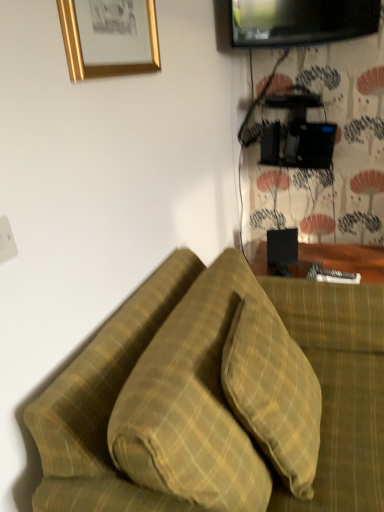
This screenshot has width=384, height=512. Describe the element at coordinates (109, 37) in the screenshot. I see `gold metallic picture frame at upper left` at that location.

Measure the distance between point (305, 3) and camera.

6.36 feet.

The width and height of the screenshot is (384, 512). Identify the location of green plaid pillow at center, positioned as the 2th pillow in right-to-left order. (220, 399).

This screenshot has height=512, width=384. What do you see at coordinates (220, 399) in the screenshot? I see `green plaid pillow at center, positioned as the 2th pillow in right-to-left order` at bounding box center [220, 399].

Locate an element on the screen. The width and height of the screenshot is (384, 512). gold metallic picture frame at upper left is located at coordinates (109, 37).

Is gold metallic picture frame at upper left closer to the viewer compared to yellow plaid pillow at center, the first pillow viewed from the right?

No, gold metallic picture frame at upper left is further to the viewer.

Does gold metallic picture frame at upper left have a larger size compared to yellow plaid pillow at center, the first pillow viewed from the right?

No, gold metallic picture frame at upper left is not bigger than yellow plaid pillow at center, the first pillow viewed from the right.

Is there a large distance between gold metallic picture frame at upper left and yellow plaid pillow at center, the first pillow viewed from the right?

Actually, gold metallic picture frame at upper left and yellow plaid pillow at center, the first pillow viewed from the right, are a little close together.

Can you tell me how much gold metallic picture frame at upper left and yellow plaid pillow at center, the second pillow when ordered from left to right, differ in facing direction?

5.81 degrees.

Is gold metallic picture frame at upper left situated inside black glossy tv at upper right or outside?

gold metallic picture frame at upper left is not enclosed by black glossy tv at upper right.

Considering the sizes of objects gold metallic picture frame at upper left and black glossy tv at upper right in the image provided, who is shorter, gold metallic picture frame at upper left or black glossy tv at upper right?

black glossy tv at upper right.

Is gold metallic picture frame at upper left aimed at black glossy tv at upper right?

No, gold metallic picture frame at upper left does not turn towards black glossy tv at upper right.

Locate an element on the screen. This screenshot has height=512, width=384. television above the gold metallic picture frame at upper left (from a real-world perspective) is located at coordinates (301, 21).

From a real-world perspective, which object rests below the other?

green plaid pillow at center, which ranks as the first pillow in left-to-right order, is physically lower.

Is gold metallic picture frame at upper left positioned beyond the bounds of green plaid pillow at center, which ranks as the first pillow in left-to-right order?

That's correct, gold metallic picture frame at upper left is outside of green plaid pillow at center, which ranks as the first pillow in left-to-right order.

From the image's perspective, is gold metallic picture frame at upper left located above or below green plaid pillow at center, which ranks as the first pillow in left-to-right order?

gold metallic picture frame at upper left is situated higher than green plaid pillow at center, which ranks as the first pillow in left-to-right order, in the image.

In the scene shown: From the image's perspective, who appears lower, black glossy tv at upper right or green plaid pillow at center, which ranks as the first pillow in left-to-right order?

From the image's view, green plaid pillow at center, which ranks as the first pillow in left-to-right order, is below.

Who is shorter, black glossy tv at upper right or green plaid pillow at center, positioned as the 2th pillow in right-to-left order?

With less height is black glossy tv at upper right.

From the image's perspective, count 2nd pillows downward from the black glossy tv at upper right and point to it. Please provide its 2D coordinates.

[(220, 399)]

Between point (238, 31) and point (194, 486), which one is positioned in front?

The point (194, 486) is more forward.

Does black glossy tv at upper right contain yellow plaid pillow at center, the second pillow when ordered from left to right?

No, yellow plaid pillow at center, the second pillow when ordered from left to right, is located outside of black glossy tv at upper right.

Who is more distant, black glossy tv at upper right or yellow plaid pillow at center, the second pillow when ordered from left to right?

black glossy tv at upper right is more distant.

From a real-world perspective, who is located lower, black glossy tv at upper right or yellow plaid pillow at center, the second pillow when ordered from left to right?

yellow plaid pillow at center, the second pillow when ordered from left to right.

Identify the location of television that appears above the yellow plaid pillow at center, the second pillow when ordered from left to right (from the image's perspective). This screenshot has height=512, width=384. (301, 21).

From the image's perspective, between yellow plaid pillow at center, the first pillow viewed from the right, and gold metallic picture frame at upper left, who is located below?

yellow plaid pillow at center, the first pillow viewed from the right, from the image's perspective.

Can you confirm if yellow plaid pillow at center, the second pillow when ordered from left to right, is taller than gold metallic picture frame at upper left?

Correct, yellow plaid pillow at center, the second pillow when ordered from left to right, is much taller as gold metallic picture frame at upper left.

Could you measure the distance between yellow plaid pillow at center, the first pillow viewed from the right, and gold metallic picture frame at upper left?

yellow plaid pillow at center, the first pillow viewed from the right, and gold metallic picture frame at upper left are 34.21 inches apart.

Is point (289, 410) closer or farther from the camera than point (133, 55)?

Point (289, 410) is positioned closer to the camera compared to point (133, 55).

What's the angular difference between green plaid pillow at center, positioned as the 2th pillow in right-to-left order, and gold metallic picture frame at upper left's facing directions?

1.66 degrees.

Does green plaid pillow at center, positioned as the 2th pillow in right-to-left order, appear on the right side of gold metallic picture frame at upper left?

Correct, you'll find green plaid pillow at center, positioned as the 2th pillow in right-to-left order, to the right of gold metallic picture frame at upper left.

Is green plaid pillow at center, positioned as the 2th pillow in right-to-left order, directly adjacent to gold metallic picture frame at upper left?

No, green plaid pillow at center, positioned as the 2th pillow in right-to-left order, is not making contact with gold metallic picture frame at upper left.

The height and width of the screenshot is (512, 384). There is a yellow plaid pillow at center, the second pillow when ordered from left to right. In order to click on picture frame above it (from a real-world perspective) in this screenshot , I will do `click(109, 37)`.

Locate an element on the screen. picture frame that appears on the left of black glossy tv at upper right is located at coordinates (109, 37).

When comparing their distances from green plaid pillow at center, which ranks as the first pillow in left-to-right order, does gold metallic picture frame at upper left or yellow plaid pillow at center, the first pillow viewed from the right, seem closer?

Based on the image, yellow plaid pillow at center, the first pillow viewed from the right, appears to be nearer to green plaid pillow at center, which ranks as the first pillow in left-to-right order.

In the scene shown: From the image, which object appears to be farther from black glossy tv at upper right, gold metallic picture frame at upper left or yellow plaid pillow at center, the second pillow when ordered from left to right?

yellow plaid pillow at center, the second pillow when ordered from left to right, is positioned further to the anchor black glossy tv at upper right.

From the image, which object appears to be farther from gold metallic picture frame at upper left, black glossy tv at upper right or yellow plaid pillow at center, the first pillow viewed from the right?

Among the two, black glossy tv at upper right is located further to gold metallic picture frame at upper left.

When comparing their distances from gold metallic picture frame at upper left, does black glossy tv at upper right or green plaid pillow at center, which ranks as the first pillow in left-to-right order, seem further?

Based on the image, black glossy tv at upper right appears to be further to gold metallic picture frame at upper left.

Based on their spatial positions, is green plaid pillow at center, which ranks as the first pillow in left-to-right order, or black glossy tv at upper right closer to yellow plaid pillow at center, the first pillow viewed from the right?

green plaid pillow at center, which ranks as the first pillow in left-to-right order, is positioned closer to the anchor yellow plaid pillow at center, the first pillow viewed from the right.

When comparing their distances from yellow plaid pillow at center, the first pillow viewed from the right, does black glossy tv at upper right or green plaid pillow at center, positioned as the 2th pillow in right-to-left order, seem further?

black glossy tv at upper right.

Looking at this image, from the image, which object appears to be nearer to green plaid pillow at center, which ranks as the first pillow in left-to-right order, gold metallic picture frame at upper left or black glossy tv at upper right?

gold metallic picture frame at upper left is closer to green plaid pillow at center, which ranks as the first pillow in left-to-right order.

Based on their spatial positions, is yellow plaid pillow at center, the first pillow viewed from the right, or black glossy tv at upper right further from green plaid pillow at center, positioned as the 2th pillow in right-to-left order?

black glossy tv at upper right is further to green plaid pillow at center, positioned as the 2th pillow in right-to-left order.

This screenshot has width=384, height=512. In order to click on picture frame between black glossy tv at upper right and yellow plaid pillow at center, the first pillow viewed from the right, from top to bottom in this screenshot , I will do `click(109, 37)`.

You are a GUI agent. You are given a task and a screenshot of the screen. Output one action in this format:
    pyautogui.click(x=<x>, y=<y>)
    Task: Click on the pillow that lies between gold metallic picture frame at upper left and green plaid pillow at center, positioned as the 2th pillow in right-to-left order, from top to bottom
    
    Given the screenshot: What is the action you would take?
    pyautogui.click(x=273, y=392)

Identify the location of pillow between black glossy tv at upper right and green plaid pillow at center, which ranks as the first pillow in left-to-right order, vertically. The height and width of the screenshot is (512, 384). (273, 392).

Find the location of a particular element. picture frame between black glossy tv at upper right and green plaid pillow at center, positioned as the 2th pillow in right-to-left order, from top to bottom is located at coordinates (109, 37).